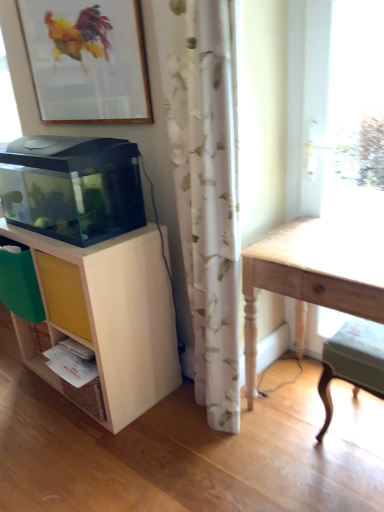
Find the location of a particular element. The height and width of the screenshot is (512, 384). vacant space that is to the left of white floral curtain at center is located at coordinates (155, 431).